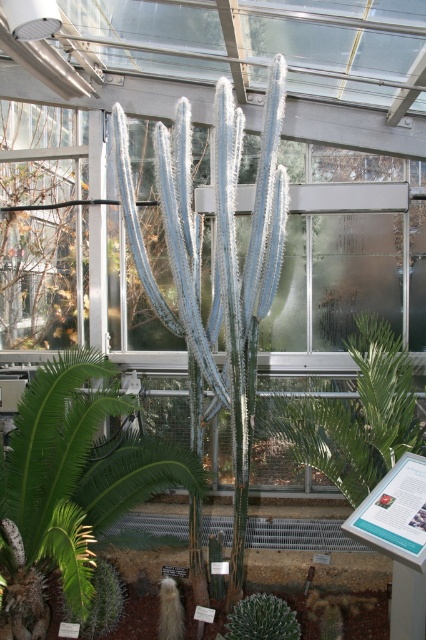
You are a gardener who needs to water both the green spiky cactus at center and the green leafy plant at center. Your watering can holds enough water for one plant. You start at the entrance of the greenhouse, which is on the left side of the image. Which plant should you water first to minimize the distance you walk?

You should water the green spiky cactus at center first because it is closer to the entrance on the left side than the green leafy plant at center, so you can water it first before moving to the farther one.

You are a gardener who wants to water the green spiky cactus at center and the green leafy plant at center. Which one should you water first if you want to avoid getting water on the other plant?

You should water the green spiky cactus at center first because it is in front of the green leafy plant at center. Watering the one in front first will prevent water from dripping onto the green leafy plant at center behind it.

You are a gardener who wants to water both the green spiky cactus at center and the green fuzzy cactus at center. Which cactus should you water first if you want to avoid getting water on the other one?

The green spiky cactus at center is located above the green fuzzy cactus at center, so you should water the green fuzzy cactus at center first to avoid water dripping onto it from the green spiky cactus at center.